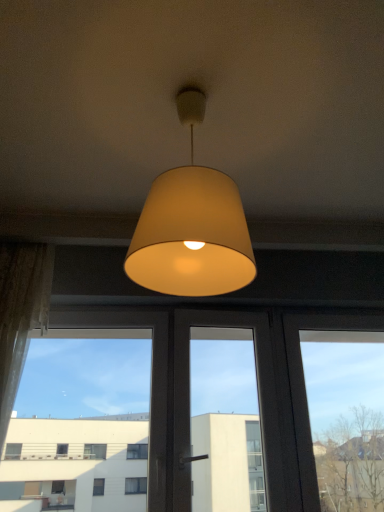
Question: Are matte beige lampshade at center and sheer lace curtain at left far apart?

Choices:
 (A) yes
 (B) no

Answer: (B)

Question: Does matte beige lampshade at center have a lesser width compared to sheer lace curtain at left?

Choices:
 (A) no
 (B) yes

Answer: (A)

Question: From a real-world perspective, is matte beige lampshade at center beneath sheer lace curtain at left?

Choices:
 (A) yes
 (B) no

Answer: (B)

Question: Is matte beige lampshade at center located outside sheer lace curtain at left?

Choices:
 (A) no
 (B) yes

Answer: (B)

Question: From a real-world perspective, is matte beige lampshade at center located higher than sheer lace curtain at left?

Choices:
 (A) no
 (B) yes

Answer: (B)

Question: Considering the relative positions of matte beige lampshade at center and sheer lace curtain at left in the image provided, is matte beige lampshade at center to the right of sheer lace curtain at left from the viewer's perspective?

Choices:
 (A) yes
 (B) no

Answer: (A)

Question: Does transparent glass window at center appear on the left side of sheer lace curtain at left?

Choices:
 (A) no
 (B) yes

Answer: (A)

Question: Considering the relative positions of transparent glass window at center and sheer lace curtain at left in the image provided, is transparent glass window at center behind sheer lace curtain at left?

Choices:
 (A) yes
 (B) no

Answer: (A)

Question: Is sheer lace curtain at left a part of transparent glass window at center?

Choices:
 (A) no
 (B) yes

Answer: (A)

Question: From a real-world perspective, is transparent glass window at center located higher than sheer lace curtain at left?

Choices:
 (A) no
 (B) yes

Answer: (A)

Question: Is transparent glass window at center taller than sheer lace curtain at left?

Choices:
 (A) yes
 (B) no

Answer: (B)

Question: From the image's perspective, is transparent glass window at center above sheer lace curtain at left?

Choices:
 (A) no
 (B) yes

Answer: (A)

Question: Is sheer lace curtain at left behind matte beige lampshade at center?

Choices:
 (A) no
 (B) yes

Answer: (B)